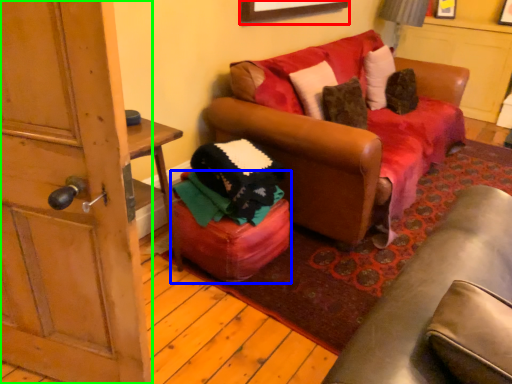
Question: Based on their relative distances, which object is nearer to picture frame (highlighted by a red box)? Choose from stool (highlighted by a blue box) and door (highlighted by a green box).

Choices:
 (A) stool
 (B) door

Answer: (A)